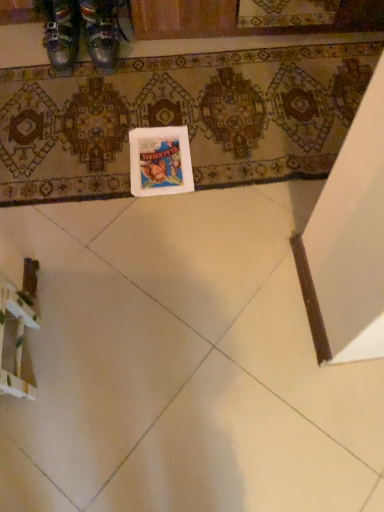
You are a GUI agent. You are given a task and a screenshot of the screen. Output one action in this format:
    pyautogui.click(x=<x>, y=<y>)
    Task: Click on the free spot above patterned carpet at center (from a real-world perspective)
    This screenshot has width=384, height=512.
    Given the screenshot: What is the action you would take?
    pyautogui.click(x=192, y=110)